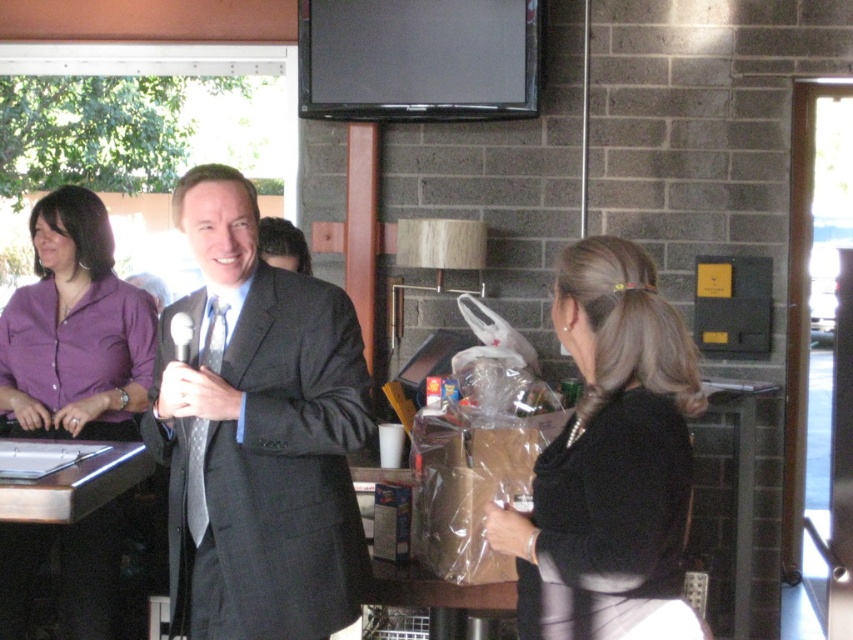
Question: Can you confirm if matte black suit at center is positioned below black satin dress at center?

Choices:
 (A) yes
 (B) no

Answer: (B)

Question: Considering the real-world distances, which object is closest to the black satin dress at center?

Choices:
 (A) purple satin blouse at left
 (B) matte black suit at center

Answer: (B)

Question: Does matte black suit at center appear on the left side of black satin dress at center?

Choices:
 (A) no
 (B) yes

Answer: (B)

Question: Which object is positioned closest to the black satin dress at center?

Choices:
 (A) matte black suit at center
 (B) purple satin blouse at left

Answer: (A)

Question: Is matte black suit at center bigger than purple satin blouse at left?

Choices:
 (A) yes
 (B) no

Answer: (B)

Question: Which point is closer to the camera?

Choices:
 (A) black satin dress at center
 (B) purple satin blouse at left

Answer: (A)